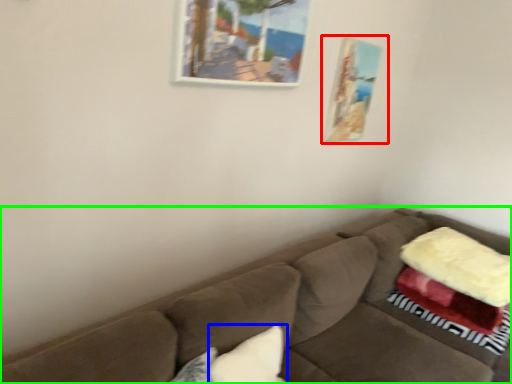
Question: Considering the real-world distances, which object is farthest from picture frame (highlighted by a red box)? pillow (highlighted by a blue box) or studio couch (highlighted by a green box)?

Choices:
 (A) pillow
 (B) studio couch

Answer: (A)